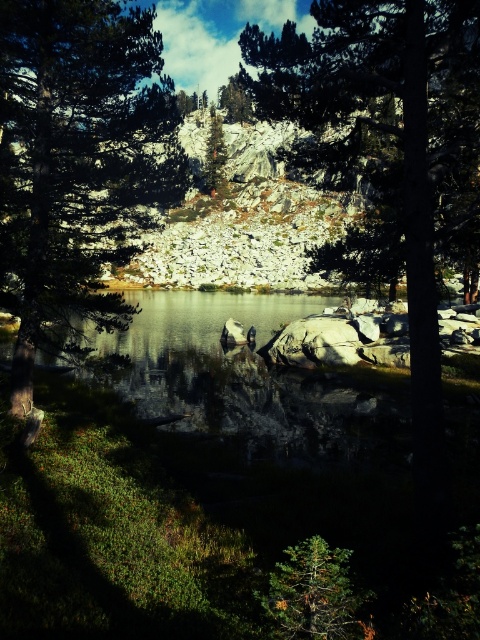
Question: Is green matte tree at center closer to camera compared to green matte tree at upper center?

Choices:
 (A) yes
 (B) no

Answer: (A)

Question: Observing the image, what is the correct spatial positioning of green textured pine tree at center in reference to green matte tree at upper center?

Choices:
 (A) right
 (B) left

Answer: (B)

Question: Which point is farther to the camera?

Choices:
 (A) (213, 122)
 (B) (4, 212)

Answer: (A)

Question: Among these points, which one is farthest from the camera?

Choices:
 (A) (448, 209)
 (B) (137, 65)
 (C) (212, 106)
 (D) (230, 92)

Answer: (C)

Question: In this image, where is green textured tree at center located relative to green matte tree at center?

Choices:
 (A) below
 (B) above

Answer: (B)

Question: Which object is the closest to the green textured tree at center?

Choices:
 (A) green textured pine tree at center
 (B) green matte tree at center
 (C) green matte tree at upper center
 (D) dark green textured tree at center

Answer: (D)